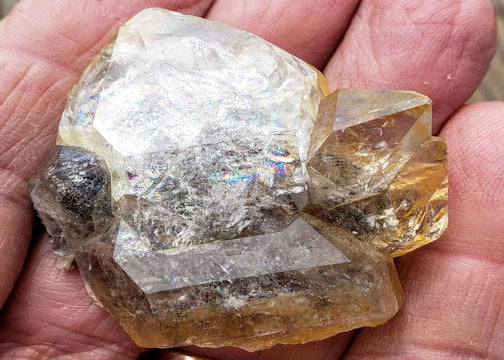
Where is `light`? This screenshot has height=360, width=504. light is located at coordinates (177, 67).